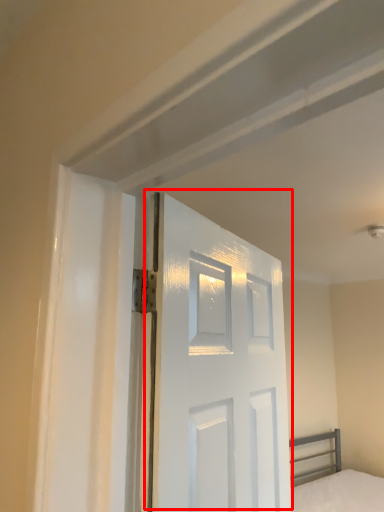
Question: Considering the relative positions of door (annotated by the red box) and bed in the image provided, where is door (annotated by the red box) located with respect to the staircase?

Choices:
 (A) right
 (B) left

Answer: (B)